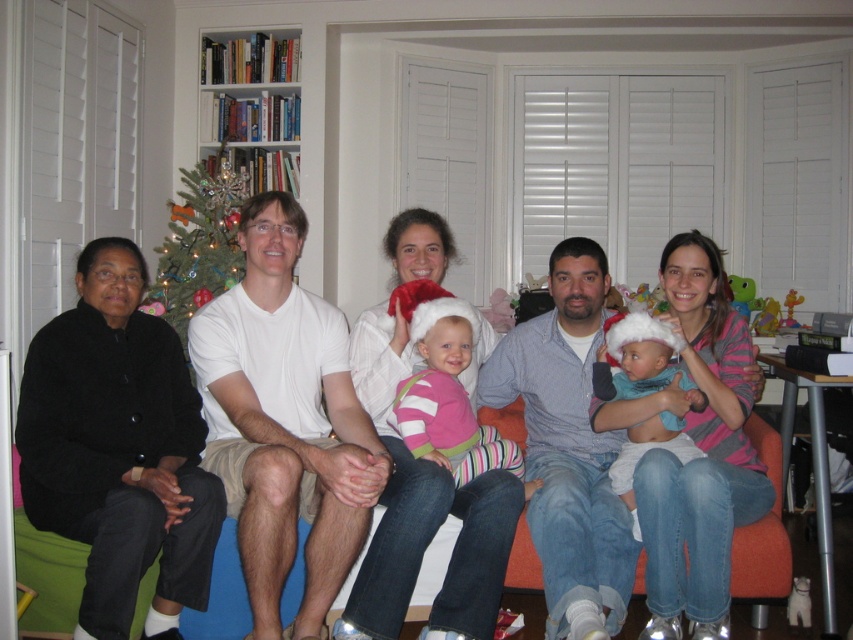
You are planning to take a photo of the green artificial christmas tree at upper left and the turquoise soft fabric baby at center. Since the camera can only focus on one object at a time, which object should you focus on first to ensure it appears larger in the photo?

The green artificial christmas tree at upper left is bigger than the turquoise soft fabric baby at center, so you should focus on the green artificial christmas tree at upper left first to ensure it appears larger in the photo.

You are a photographer trying to adjust the lighting for a group photo. You notice the black sweater at left and the pink striped sweater at center. Which sweater is closer to the camera?

The black sweater at left is positioned under the pink striped sweater at center, so the pink striped sweater at center is closer to the camera.

You are a photographer trying to capture a group photo of the six people on the orange couch. You want to ensure that both the pink striped sweater at center and the turquoise soft fabric baby at center are clearly visible in the photo. Given their sizes, which object should you focus on first to ensure it fits within the frame?

The pink striped sweater at center is larger in width than the turquoise soft fabric baby at center, so you should focus on ensuring the pink striped sweater at center fits first to accommodate its size.